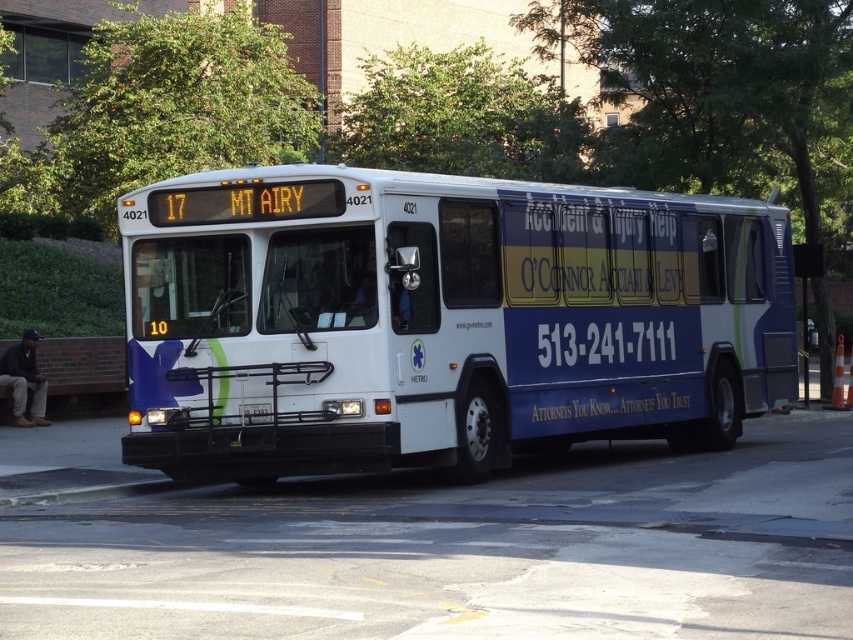
Question: Which of the following is the closest to the observer?

Choices:
 (A) white glossy bus at center
 (B) black plastic license plate at center

Answer: (A)

Question: Which point is farther to the camera?

Choices:
 (A) black plastic license plate at center
 (B) white glossy bus at center

Answer: (A)

Question: Can you confirm if white glossy bus at center is smaller than black plastic license plate at center?

Choices:
 (A) yes
 (B) no

Answer: (B)

Question: Which point is farther to the camera?

Choices:
 (A) (265, 412)
 (B) (271, 307)

Answer: (B)

Question: Is white glossy bus at center to the left of black plastic license plate at center from the viewer's perspective?

Choices:
 (A) no
 (B) yes

Answer: (A)

Question: From the image, what is the correct spatial relationship of white glossy bus at center in relation to black plastic license plate at center?

Choices:
 (A) left
 (B) right

Answer: (B)